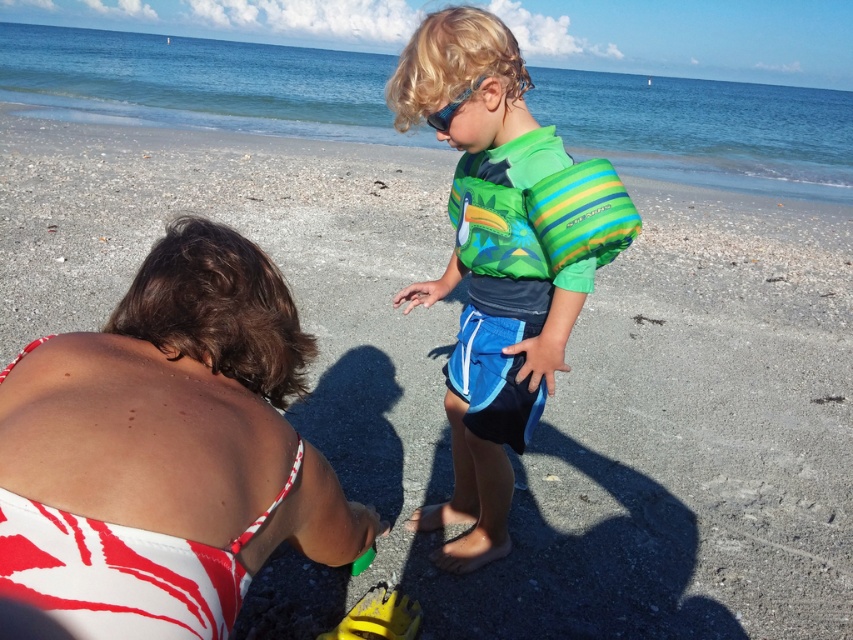
Which of these two, green matte swimsuit at center or green striped life jacket at center, stands shorter?

green striped life jacket at center is shorter.

Where is `green matte swimsuit at center`? The image size is (853, 640). green matte swimsuit at center is located at coordinates (498, 401).

Where is `green matte swimsuit at center`? This screenshot has width=853, height=640. green matte swimsuit at center is located at coordinates point(498,401).

Which is behind, point (158, 621) or point (433, 115)?

Point (433, 115)

Which of these two, white printed swimsuit at lower left or transparent plastic goggles at upper center, stands taller?

With more height is white printed swimsuit at lower left.

Between point (177, 353) and point (474, 88), which one is positioned in front?

Point (177, 353)

At what (x,y) coordinates should I click in order to perform the action: click on white printed swimsuit at lower left. Please return your answer as a coordinate pair (x, y). Looking at the image, I should click on (166, 449).

Between white printed swimsuit at lower left and green matte swimsuit at center, which one has less height?

white printed swimsuit at lower left

The width and height of the screenshot is (853, 640). What do you see at coordinates (166, 449) in the screenshot?
I see `white printed swimsuit at lower left` at bounding box center [166, 449].

You are a GUI agent. You are given a task and a screenshot of the screen. Output one action in this format:
    pyautogui.click(x=<x>, y=<y>)
    Task: Click on the white printed swimsuit at lower left
    This screenshot has width=853, height=640.
    Given the screenshot: What is the action you would take?
    coord(166,449)